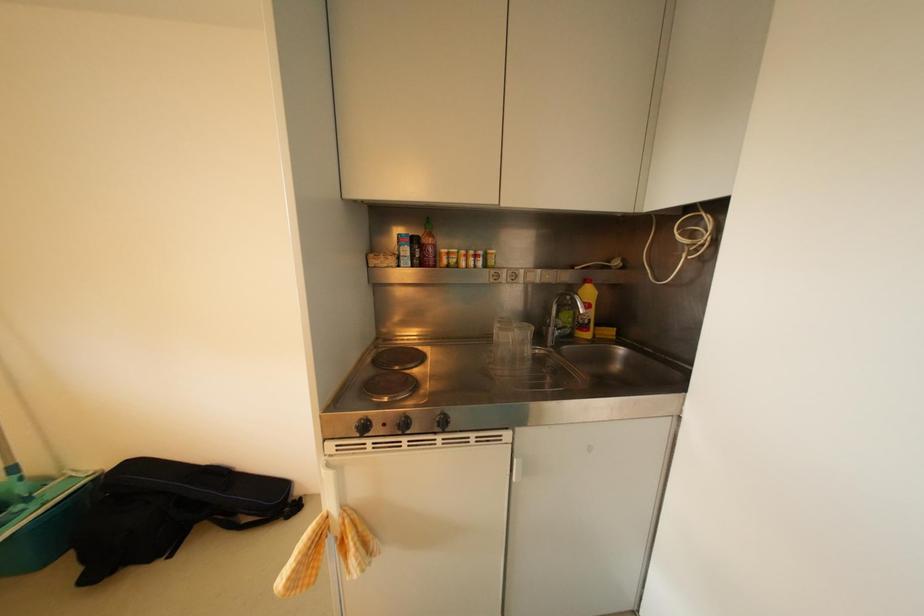
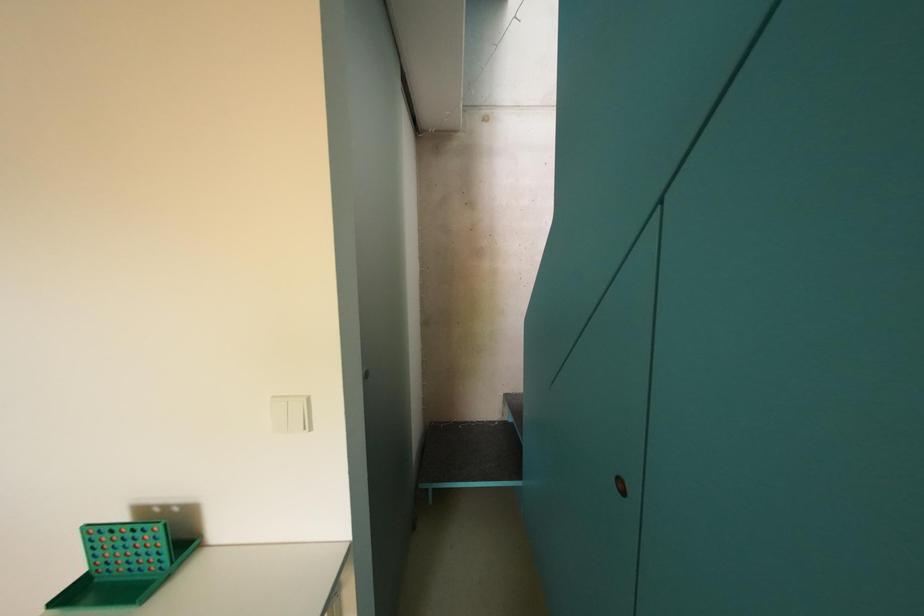
Question: The camera is either moving clockwise (left) or counter-clockwise (right) around the object. The first image is from the beginning of the video and the second image is from the end. Is the camera moving left or right when shooting the video?

Choices:
 (A) Left
 (B) Right

Answer: (A)